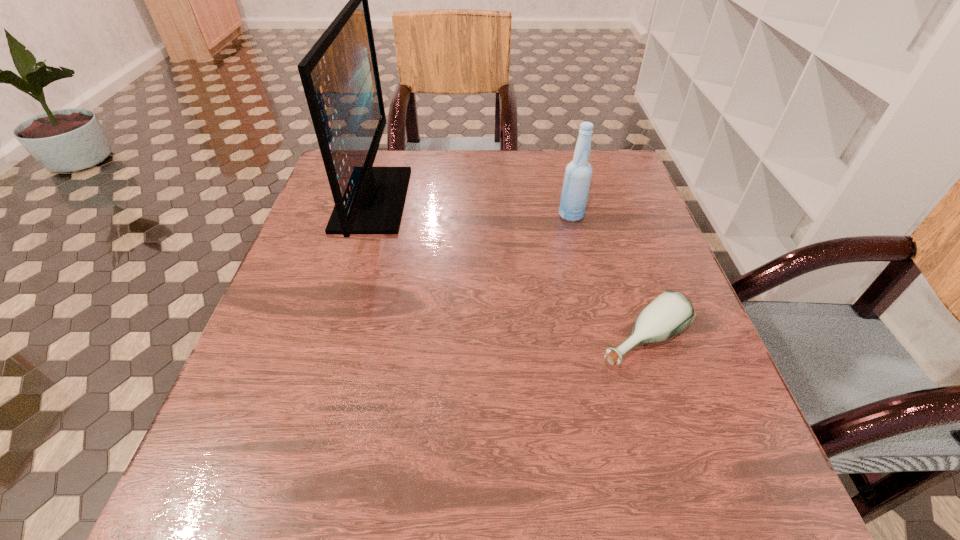
The image size is (960, 540). In order to click on free space that satisfies the following two spatial constraints: 1. on the screen side of the nearer bottle; 2. on the left side of the monitor in this screenshot , I will do `click(330, 340)`.

Locate an element on the screen. This screenshot has width=960, height=540. free location that satisfies the following two spatial constraints: 1. on the screen side of the leftmost object; 2. on the right side of the shorter bottle is located at coordinates (330, 340).